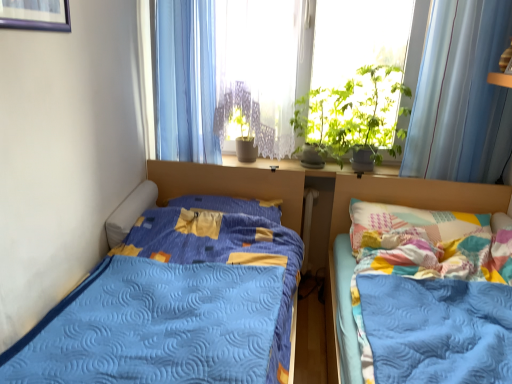
Question: Does blue sheer curtain at upper center, the second curtain in the right-to-left sequence, come behind white plastic radiator at center?

Choices:
 (A) no
 (B) yes

Answer: (A)

Question: Does blue sheer curtain at upper center, the second curtain in the right-to-left sequence, appear on the right side of white plastic radiator at center?

Choices:
 (A) no
 (B) yes

Answer: (A)

Question: Is white plastic radiator at center surrounded by blue sheer curtain at upper center, the second curtain in the right-to-left sequence?

Choices:
 (A) no
 (B) yes

Answer: (A)

Question: Is the depth of blue sheer curtain at upper center, the 1th curtain when ordered from left to right, less than that of white plastic radiator at center?

Choices:
 (A) no
 (B) yes

Answer: (B)

Question: Can you confirm if blue sheer curtain at upper center, the 1th curtain when ordered from left to right, is shorter than white plastic radiator at center?

Choices:
 (A) yes
 (B) no

Answer: (B)

Question: Based on their positions, is translucent fabric at center located to the left or right of green leafy plant at upper center?

Choices:
 (A) right
 (B) left

Answer: (B)

Question: Is translucent fabric at center bigger or smaller than green leafy plant at upper center?

Choices:
 (A) big
 (B) small

Answer: (A)

Question: Is translucent fabric at center taller or shorter than green leafy plant at upper center?

Choices:
 (A) short
 (B) tall

Answer: (B)

Question: From a real-world perspective, is translucent fabric at center physically located above or below green leafy plant at upper center?

Choices:
 (A) above
 (B) below

Answer: (A)

Question: From a real-world perspective, is green leafy plant at upper center above or below blue quilted bed at left, which ranks as the first bed in left-to-right order?

Choices:
 (A) below
 (B) above

Answer: (B)

Question: Visually, is green leafy plant at upper center positioned to the left or to the right of blue quilted bed at left, which ranks as the first bed in left-to-right order?

Choices:
 (A) right
 (B) left

Answer: (A)

Question: Is green leafy plant at upper center spatially inside blue quilted bed at left, which ranks as the first bed in left-to-right order, or outside of it?

Choices:
 (A) outside
 (B) inside

Answer: (A)

Question: Looking at their shapes, would you say green leafy plant at upper center is wider or thinner than blue quilted bed at left, which is counted as the 2th bed, starting from the right?

Choices:
 (A) thin
 (B) wide

Answer: (A)

Question: In the image, is translucent fabric at center positioned in front of or behind light blue sheer curtain at upper right, the 2th curtain positioned from the left?

Choices:
 (A) behind
 (B) front

Answer: (A)

Question: Does point (154, 67) appear closer or farther from the camera than point (462, 82)?

Choices:
 (A) farther
 (B) closer

Answer: (A)